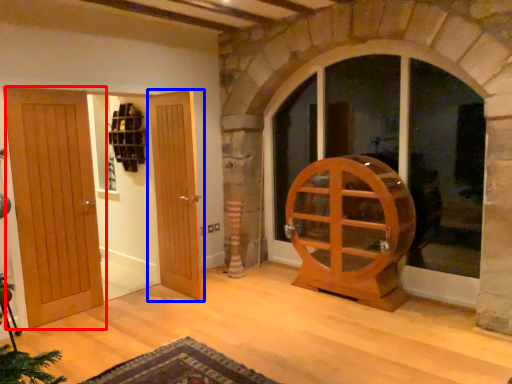
Question: Which point is further to the camera, door (highlighted by a red box) or door (highlighted by a blue box)?

Choices:
 (A) door
 (B) door

Answer: (B)